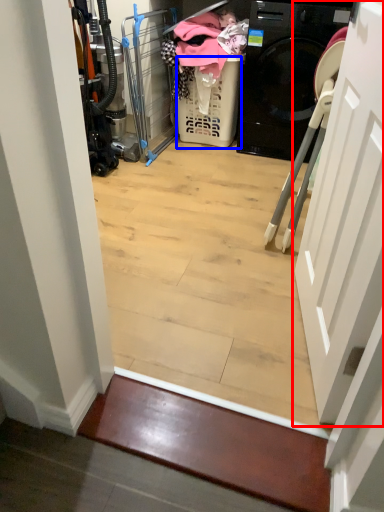
Question: Among these objects, which one is nearest to the camera, door (highlighted by a red box) or basket (highlighted by a blue box)?

Choices:
 (A) door
 (B) basket

Answer: (A)